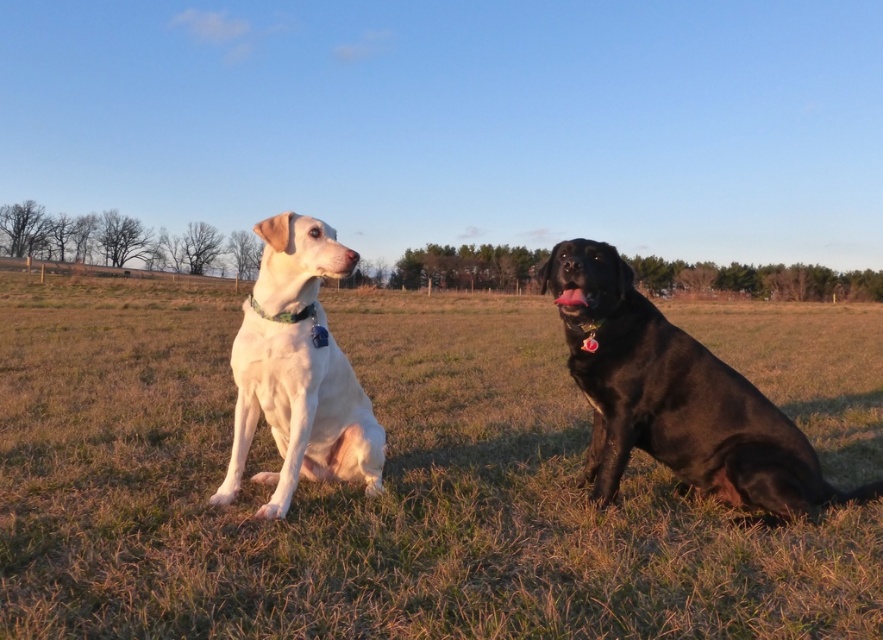
Does point (658, 522) lie in front of point (730, 396)?

Yes, it is in front of point (730, 396).

Locate an element on the screen. This screenshot has height=640, width=883. grassy field at center is located at coordinates (361, 492).

How distant is black glossy dog at right from white matte dog at left?

black glossy dog at right and white matte dog at left are 4.95 feet apart.

Can you confirm if black glossy dog at right is bigger than white matte dog at left?

Correct, black glossy dog at right is larger in size than white matte dog at left.

Find the location of `black glossy dog at right`. black glossy dog at right is located at coordinates (674, 397).

Can you confirm if grassy field at center is positioned to the right of white matte dog at left?

Incorrect, grassy field at center is not on the right side of white matte dog at left.

What do you see at coordinates (361, 492) in the screenshot?
I see `grassy field at center` at bounding box center [361, 492].

Locate an element on the screen. The image size is (883, 640). grassy field at center is located at coordinates (361, 492).